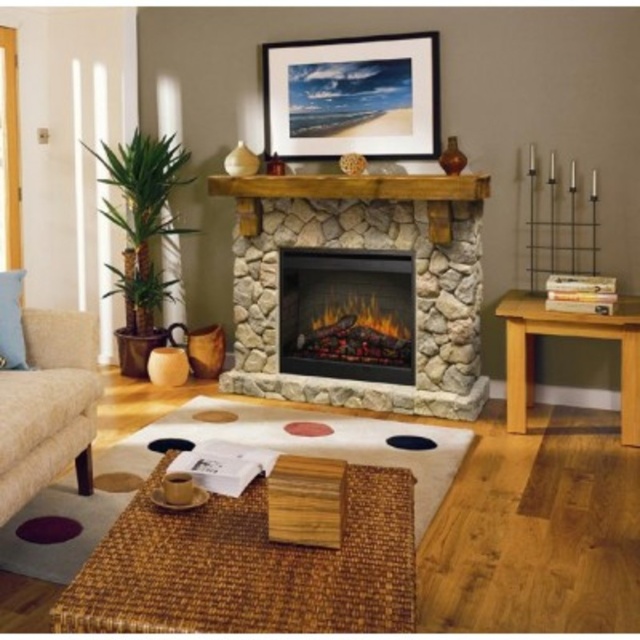
Question: Which point is farther to the camera?

Choices:
 (A) (397, 51)
 (B) (0, 499)

Answer: (A)

Question: Which object is positioned farthest from the beige fabric couch at lower left?

Choices:
 (A) matte stone fireplace at center
 (B) matte black picture frame at upper center
 (C) light brown wooden table at right
 (D) woven wood coffee table at center

Answer: (C)

Question: Where is matte stone fireplace at center located in relation to light brown wooden table at right in the image?

Choices:
 (A) above
 (B) below

Answer: (A)

Question: Among these objects, which one is farthest from the camera?

Choices:
 (A) matte black picture frame at upper center
 (B) matte stone fireplace at center

Answer: (B)

Question: From the image, what is the correct spatial relationship of matte black picture frame at upper center in relation to matte stone fireplace at center?

Choices:
 (A) below
 (B) above

Answer: (B)

Question: Is matte stone fireplace at center smaller than light brown wooden table at right?

Choices:
 (A) yes
 (B) no

Answer: (A)